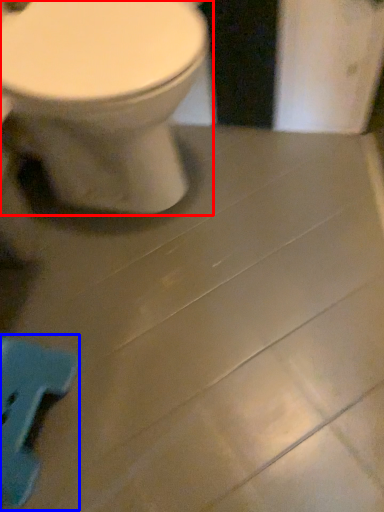
Question: Which object is closer to the camera taking this photo, toilet (highlighted by a red box) or porcelain (highlighted by a blue box)?

Choices:
 (A) toilet
 (B) porcelain

Answer: (A)